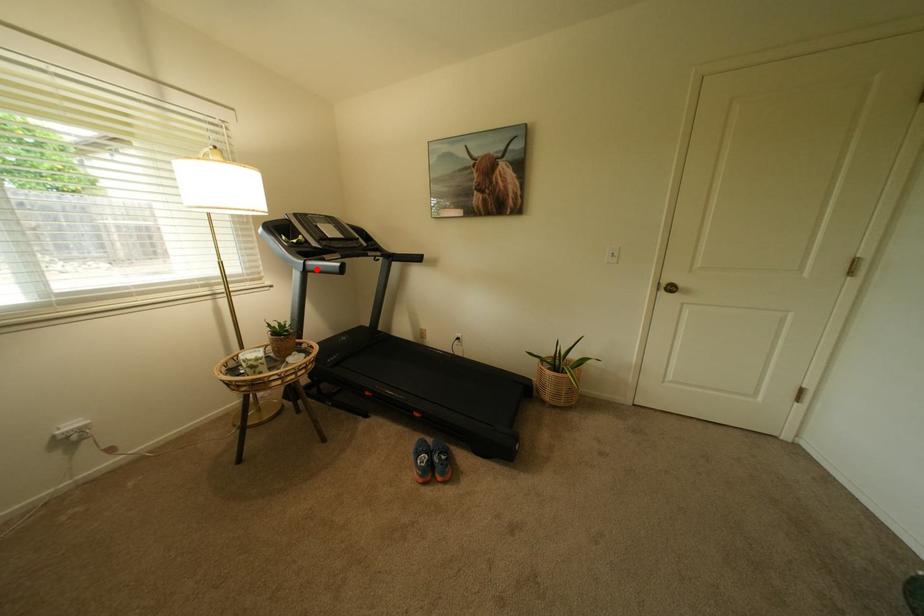
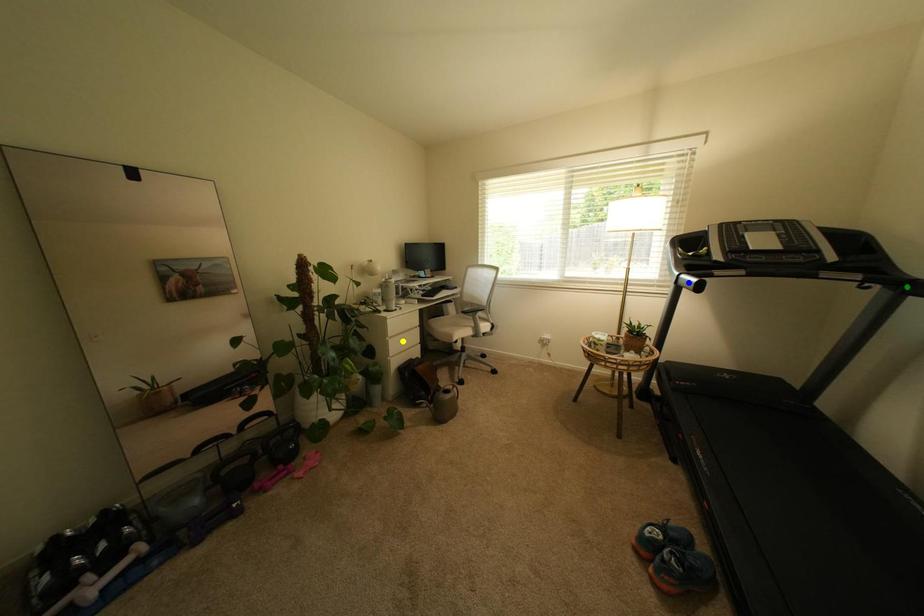
Question: I am providing you with two images of the same scene from different viewpoints. A red point is marked on the first image. You are given multiple points on the second image. Which point in image 2 represents the same 3d spot as the red point in image 1?

Choices:
 (A) blue point
 (B) yellow point
 (C) green point

Answer: (A)